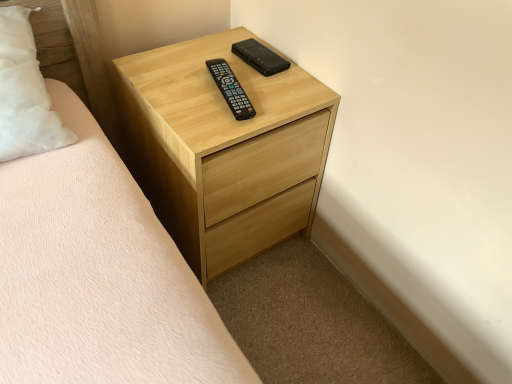
The height and width of the screenshot is (384, 512). Find the location of `space that is in front of black plastic remote at center, the first control in the bottom-to-top sequence`. space that is in front of black plastic remote at center, the first control in the bottom-to-top sequence is located at coordinates (215, 130).